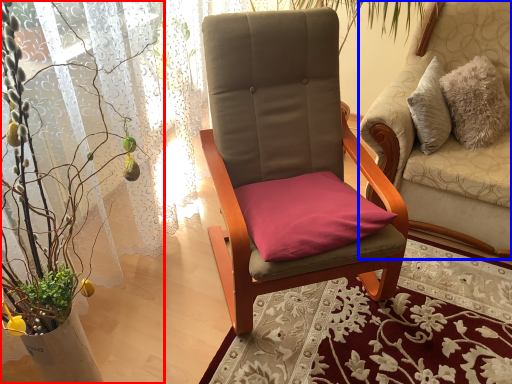
Question: Which object is closer to the camera taking this photo, houseplant (highlighted by a red box) or chair (highlighted by a blue box)?

Choices:
 (A) houseplant
 (B) chair

Answer: (A)